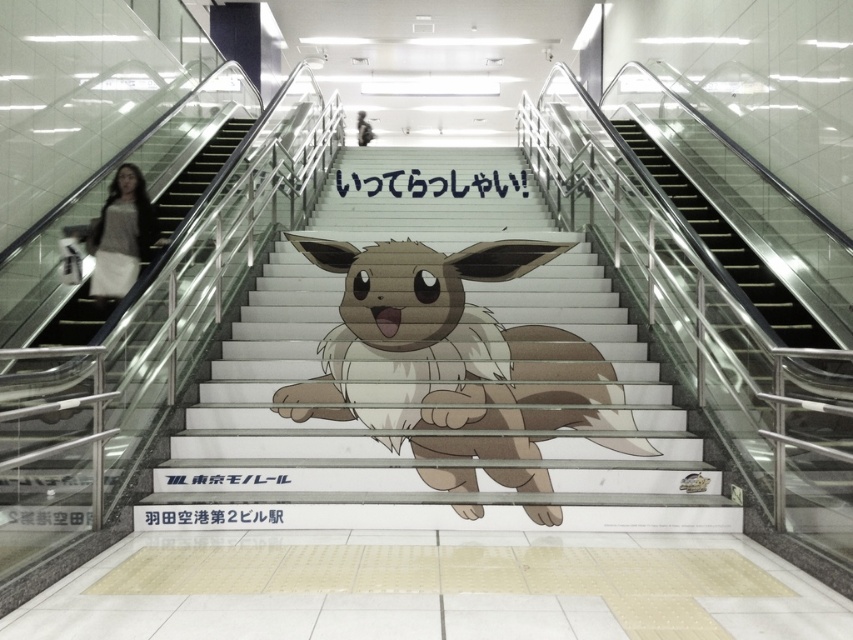
Is brown furry stairs at center bigger than light brown sweater at left?

No, brown furry stairs at center is not bigger than light brown sweater at left.

Who is lower down, brown furry stairs at center or light brown sweater at left?

brown furry stairs at center is lower down.

Find the location of a particular element. brown furry stairs at center is located at coordinates (434, 374).

Measure the distance between brown furry creature at center and camera.

They are 4.32 meters apart.

Who is higher up, brown furry creature at center or smooth skin person at center?

smooth skin person at center is above.

Is point (395, 384) farther from camera compared to point (361, 131)?

No.

This screenshot has height=640, width=853. I want to click on brown furry creature at center, so click(447, 355).

Based on the photo, is brown furry creature at center thinner than light brown sweater at left?

Incorrect, brown furry creature at center's width is not less than light brown sweater at left's.

Between brown furry creature at center and light brown sweater at left, which one has less height?

light brown sweater at left

Where is `brown furry creature at center`? brown furry creature at center is located at coordinates (447, 355).